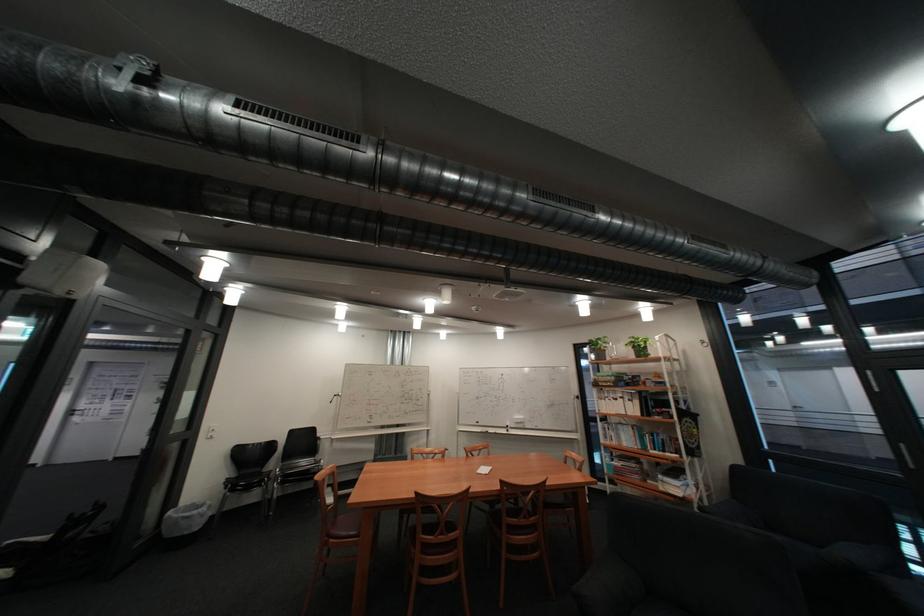
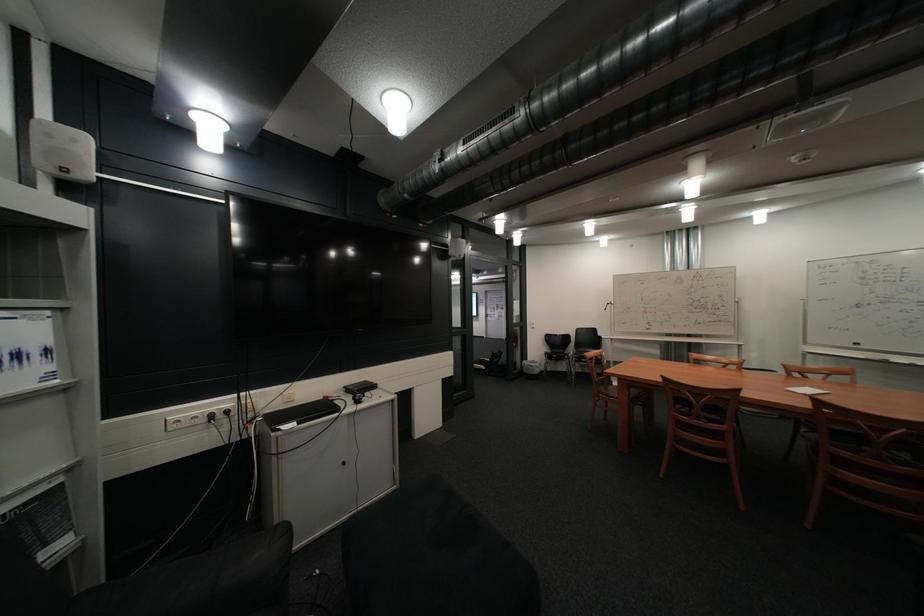
The point at (179, 512) is marked in the first image. Where is the corresponding point in the second image?

(537, 361)